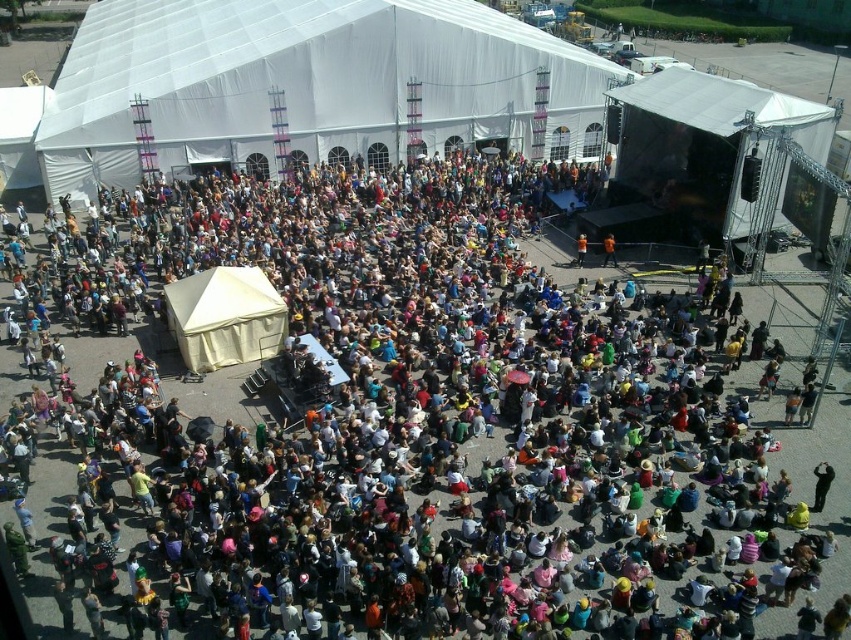
Which of these two, white matte tent at upper right or white canvas tent at center, stands shorter?

With less height is white canvas tent at center.

Is point (781, 202) closer to viewer compared to point (215, 305)?

No, (781, 202) is further to viewer.

What are the coordinates of `white matte tent at upper right` in the screenshot? It's located at (711, 145).

What do you see at coordinates (311, 86) in the screenshot? Image resolution: width=851 pixels, height=640 pixels. I see `white fabric canopy at upper center` at bounding box center [311, 86].

From the picture: Does white fabric canopy at upper center appear over white matte tent at upper right?

Correct, white fabric canopy at upper center is located above white matte tent at upper right.

Between point (192, 100) and point (655, 84), which one is positioned behind?

The point (192, 100) is behind.

Locate an element on the screen. white fabric canopy at upper center is located at coordinates (311, 86).

How distant is white fabric canopy at upper center from white canvas tent at center?

A distance of 25.44 meters exists between white fabric canopy at upper center and white canvas tent at center.

Which is more to the left, white fabric canopy at upper center or white canvas tent at center?

white fabric canopy at upper center

Does point (164, 20) come behind point (241, 310)?

Yes, point (164, 20) is farther from viewer.

Identify the location of white fabric canopy at upper center. The image size is (851, 640). (311, 86).